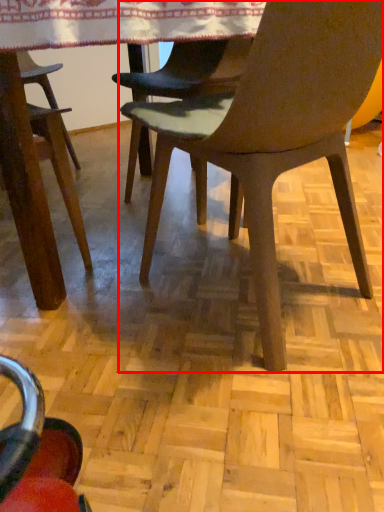
Question: From the image's perspective, where is chair (annotated by the red box) located relative to tablecloth?

Choices:
 (A) below
 (B) above

Answer: (A)